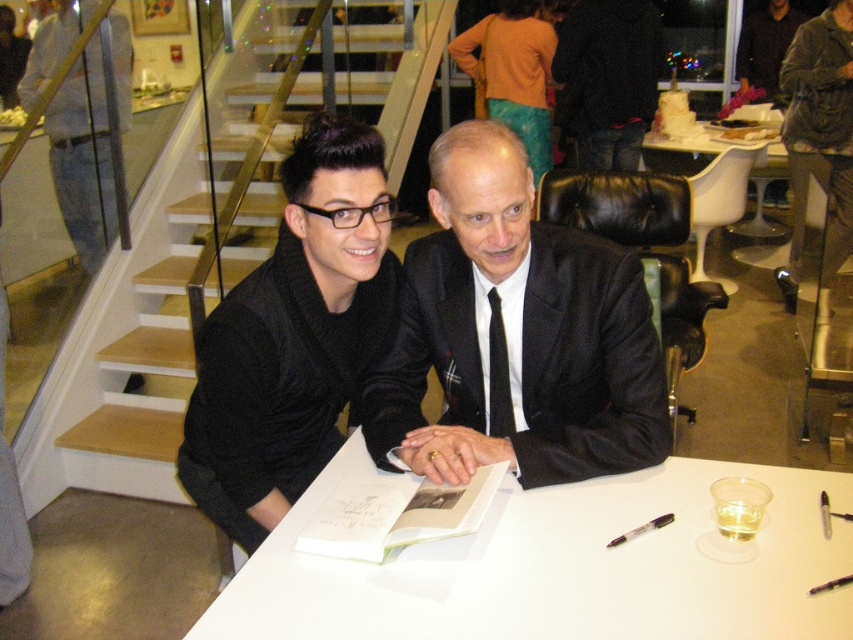
Is black silk suit at center closer to camera compared to black plastic pen at lower right?

No, it is behind black plastic pen at lower right.

Looking at this image, does black silk suit at center appear on the right side of black plastic pen at lower right?

Incorrect, black silk suit at center is not on the right side of black plastic pen at lower right.

The height and width of the screenshot is (640, 853). What do you see at coordinates (277, 385) in the screenshot?
I see `black silk suit at center` at bounding box center [277, 385].

Image resolution: width=853 pixels, height=640 pixels. What are the coordinates of `black silk suit at center` in the screenshot? It's located at (277, 385).

The width and height of the screenshot is (853, 640). What do you see at coordinates (515, 333) in the screenshot?
I see `black matte suit at center` at bounding box center [515, 333].

Is point (520, 186) positioned behind point (213, 356)?

No.

Find the location of a particular element. black matte suit at center is located at coordinates (515, 333).

In the scene shown: Does black matte suit at center have a lesser height compared to black plastic pen at lower right?

In fact, black matte suit at center may be taller than black plastic pen at lower right.

Identify the location of black matte suit at center. (515, 333).

The height and width of the screenshot is (640, 853). What do you see at coordinates (515, 333) in the screenshot? I see `black matte suit at center` at bounding box center [515, 333].

Identify the location of black matte suit at center. The image size is (853, 640). (515, 333).